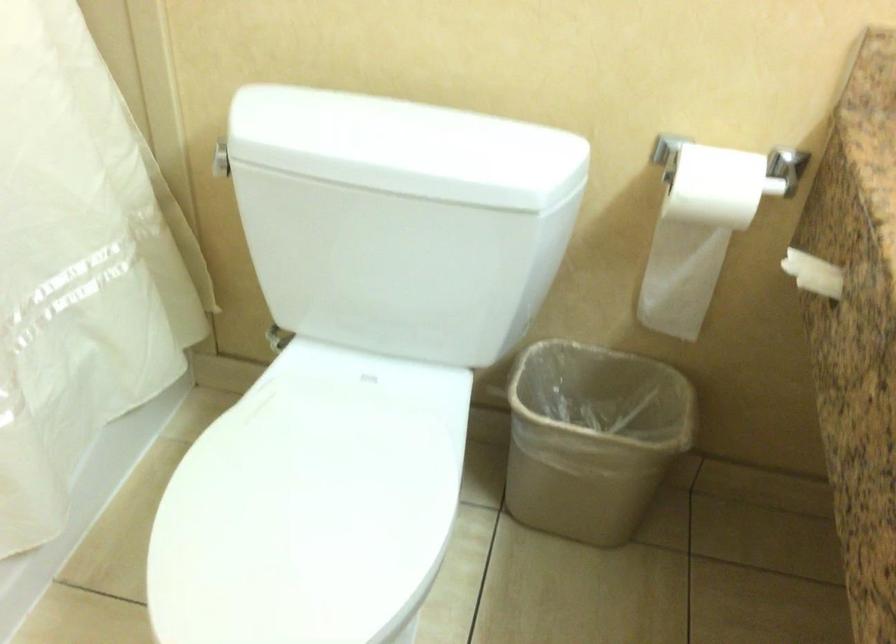
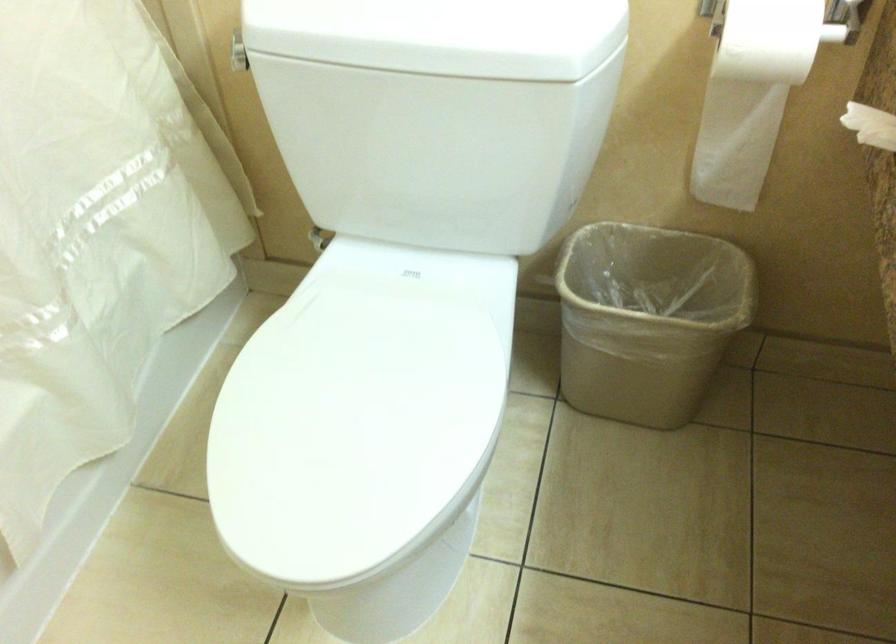
The point at [700,234] is marked in the first image. Where is the corresponding point in the second image?

(752, 93)